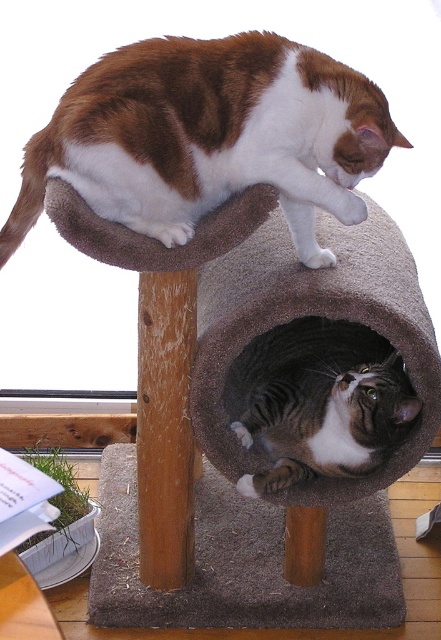
Does brown and white fur cat at upper center have a lesser width compared to gray carpeted cat bed at center?

In fact, brown and white fur cat at upper center might be wider than gray carpeted cat bed at center.

Who is higher up, brown and white fur cat at upper center or gray carpeted cat bed at center?

brown and white fur cat at upper center

This screenshot has width=441, height=640. What do you see at coordinates (209, 138) in the screenshot?
I see `brown and white fur cat at upper center` at bounding box center [209, 138].

I want to click on brown and white fur cat at upper center, so [x=209, y=138].

Between fuzzy gray cat bed at upper center and gray striped cat at lower center, which one is positioned lower?

Positioned lower is gray striped cat at lower center.

Does fuzzy gray cat bed at upper center have a smaller size compared to gray striped cat at lower center?

No.

Who is more forward, (160,376) or (324,426)?

Point (324,426)

Where is `fuzzy gray cat bed at upper center`? The height and width of the screenshot is (640, 441). fuzzy gray cat bed at upper center is located at coordinates (163, 358).

Can you confirm if gray carpeted cat bed at center is positioned below gray striped cat at lower center?

Actually, gray carpeted cat bed at center is above gray striped cat at lower center.

Which is below, gray carpeted cat bed at center or gray striped cat at lower center?

Positioned lower is gray striped cat at lower center.

Is point (418, 445) positioned after point (295, 349)?

No.

Identify the location of gray carpeted cat bed at center. The image size is (441, 640). (302, 316).